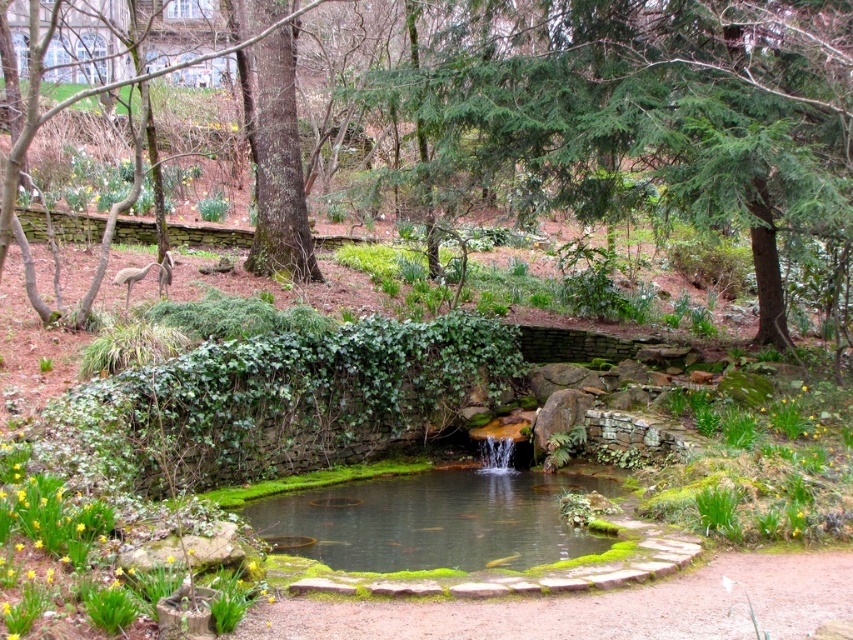
Is green leafy tree at center taller than clear water at pond center?

Indeed, green leafy tree at center has a greater height compared to clear water at pond center.

Is green leafy tree at center above clear water at pond center?

Indeed, green leafy tree at center is positioned over clear water at pond center.

Is point (727, 198) in front of point (347, 541)?

That is False.

Image resolution: width=853 pixels, height=640 pixels. I want to click on green leafy tree at center, so tap(648, 113).